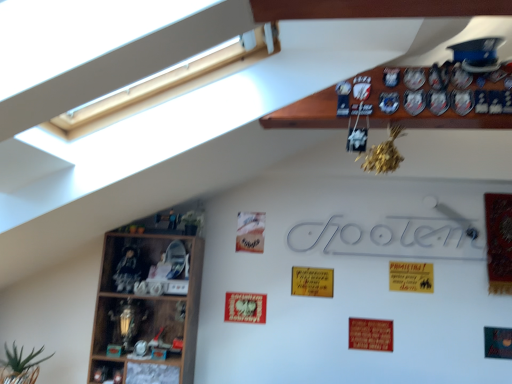
Based on the photo, in order to face green leafy plant in clear vase at lower left, should I rotate leftwards or rightwards?

Rotate left and turn 28.668 degrees.

What do you see at coordinates (20, 366) in the screenshot? I see `green leafy plant in clear vase at lower left` at bounding box center [20, 366].

Locate an element on the screen. The image size is (512, 384). green leafy plant in clear vase at lower left is located at coordinates (20, 366).

The image size is (512, 384). I want to click on green leafy plant in clear vase at lower left, so 20,366.